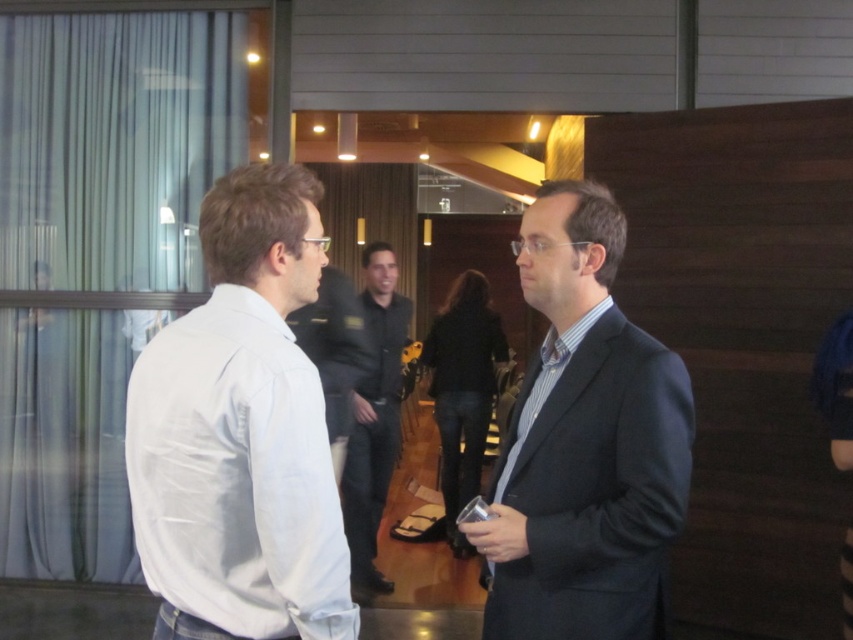
Between dark blue suit at center and dark gray shirt at center, which one appears on the left side from the viewer's perspective?

dark gray shirt at center

Who is more forward, (x=544, y=212) or (x=358, y=573)?

Point (x=544, y=212) is in front.

What are the coordinates of `dark blue suit at center` in the screenshot? It's located at (584, 444).

Who is more distant from viewer, [291,397] or [405,342]?

The point [405,342] is more distant.

Measure the distance between white cotton shirt at left and camera.

A distance of 1.30 meters exists between white cotton shirt at left and camera.

Which is in front, point (245, 349) or point (379, 509)?

Point (245, 349) is in front.

Find the location of `white cotton shirt at left`. white cotton shirt at left is located at coordinates (241, 433).

Is point (264, 337) positioned in front of point (585, 545)?

Yes, point (264, 337) is in front of point (585, 545).

Is white cotton shirt at left positioned before dark blue suit at center?

Yes, it is in front of dark blue suit at center.

Find the location of a particular element. white cotton shirt at left is located at coordinates 241,433.